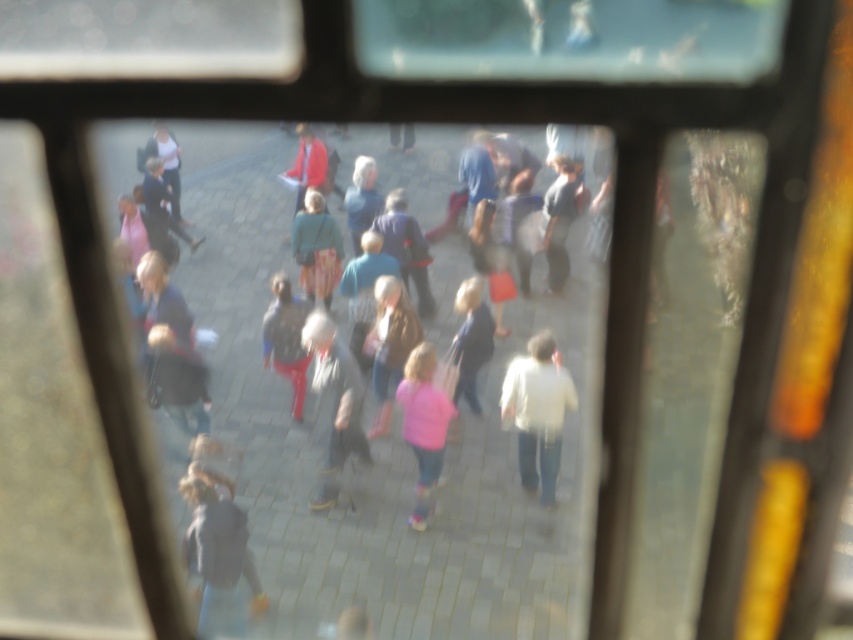
You are inside a moving vehicle and see two points outside through the window. The first point is at coordinates point (314, 259) and the second is at point (175, 157). Which point is closer to the camera inside the vehicle?

Point (314, 259) is further to the camera than point (175, 157), so the second point is closer to the camera.

You are a passenger on a moving vehicle and notice two items through the window at the center of your view. The items are the light pink fabric at center and the matte red jacket at center. Which one is positioned more to the right side?

The light pink fabric at center is positioned to the right of the matte red jacket at center, so the light pink fabric at center is more to the right.

You are a passenger on a moving train and notice a point marked at coordinates (286, 339) through the window. What object is located at that point?

The point at coordinates (286, 339) corresponds to the matte black jacket at center.